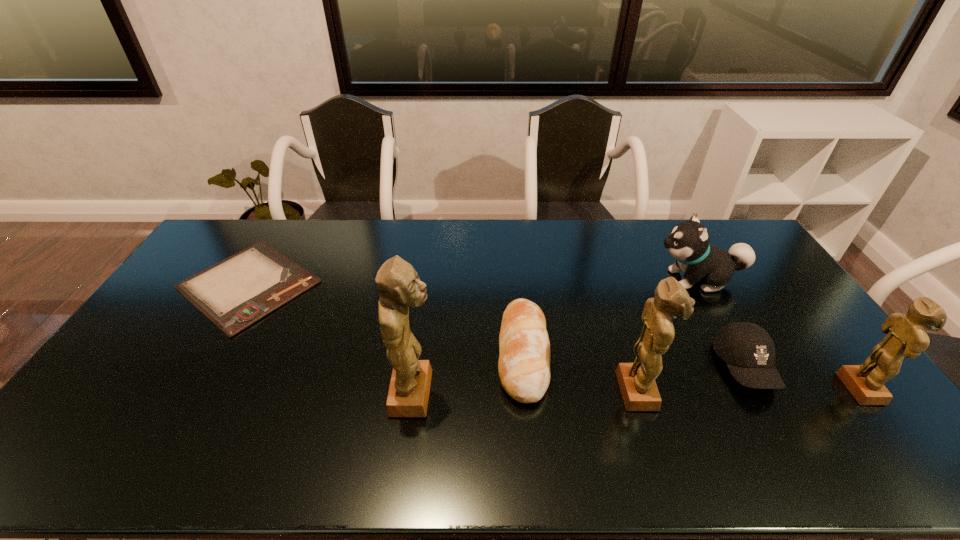
Where is `object that is at the left edge`? object that is at the left edge is located at coordinates (236, 292).

Locate an element on the screen. figurine that is at the right edge is located at coordinates (906, 336).

Locate an element on the screen. Image resolution: width=960 pixels, height=540 pixels. puppy present at the right edge is located at coordinates (688, 242).

Identify the location of object at the far left corner. Image resolution: width=960 pixels, height=540 pixels. (236, 292).

You are a GUI agent. You are given a task and a screenshot of the screen. Output one action in this format:
    pyautogui.click(x=<x>, y=<y>)
    Task: Click on the object located at the near right corner
    The image size is (960, 540).
    Given the screenshot: What is the action you would take?
    pyautogui.click(x=906, y=336)

Where is `vacant space at the far edge of the desktop`? The image size is (960, 540). vacant space at the far edge of the desktop is located at coordinates (600, 231).

This screenshot has width=960, height=540. In order to click on free space at the near edge of the desktop in this screenshot , I will do `click(155, 411)`.

In the image, there is a desktop. Identify the location of vacant region at the left edge. The height and width of the screenshot is (540, 960). (145, 366).

In the image, there is a desktop. Identify the location of free space at the right edge. (787, 360).

The image size is (960, 540). I want to click on free spot between the second object from left to right and the leftmost object, so click(331, 339).